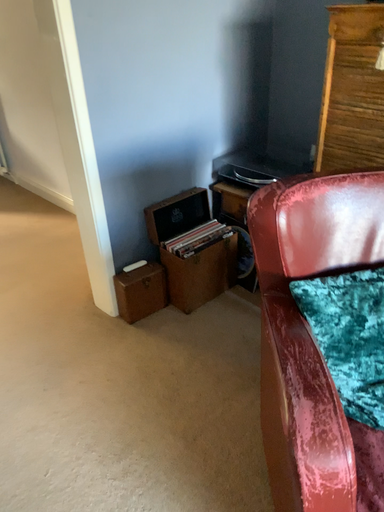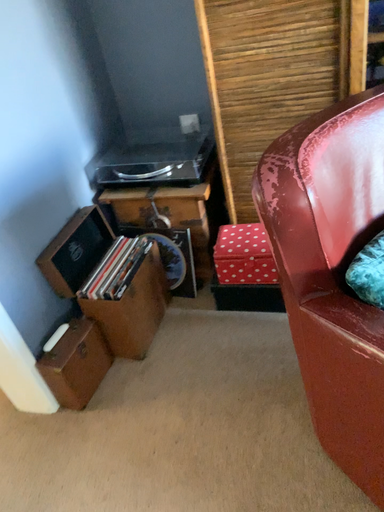
Question: How did the camera likely rotate when shooting the video?

Choices:
 (A) rotated left
 (B) rotated right

Answer: (B)